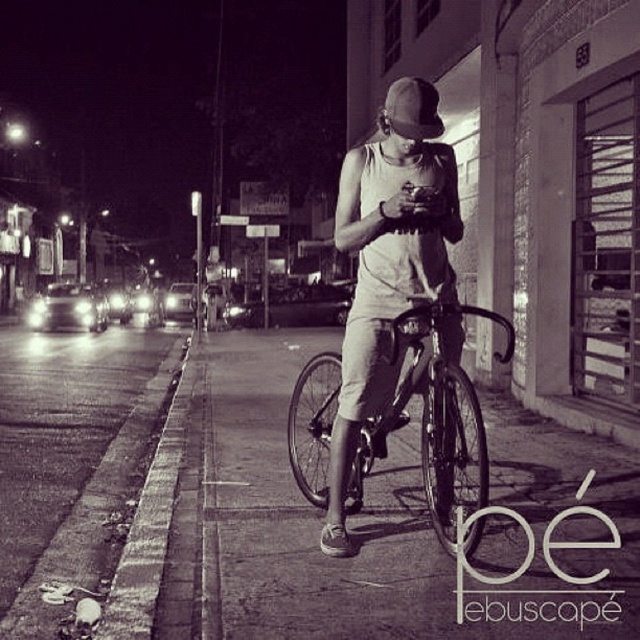
You are a photographer standing on the sidewalk next to the metallic silver bicycle at center and the matte black baseball hat at center. You want to take a photo of the bicycle without the hat blocking the view. Which object should you move to ensure the bicycle is fully visible?

The metallic silver bicycle at center is shorter than the matte black baseball hat at center. To ensure the bicycle is fully visible, you should move the matte black baseball hat at center out of the way since it is taller and could block the view.

You are a photographer trying to capture the scene with your camera. You notice the matte white tank top at center and the metallic silver bicycle at center. Which object is narrower in your photo?

The matte white tank top at center is narrower than the metallic silver bicycle at center in the photo.

You are a fashion designer observing the person in the image. You need to determine if their matte white tank top at center and matte black baseball hat at center are positioned in a way that allows for a comfortable head movement. Given that the average human head has a circumference of 22 inches, can you confirm if there is enough space between them?

The distance between the matte white tank top at center and the matte black baseball hat at center is 36.51 inches, which is significantly larger than the average human head circumference of 22 inches. This means there is ample space for comfortable head movement between the two items.